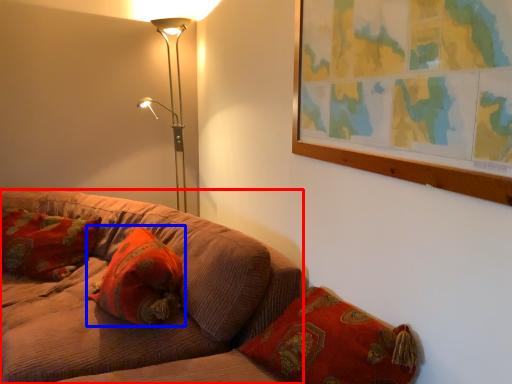
Question: Which point is further to the camera, studio couch (highlighted by a red box) or pillow (highlighted by a blue box)?

Choices:
 (A) studio couch
 (B) pillow

Answer: (B)